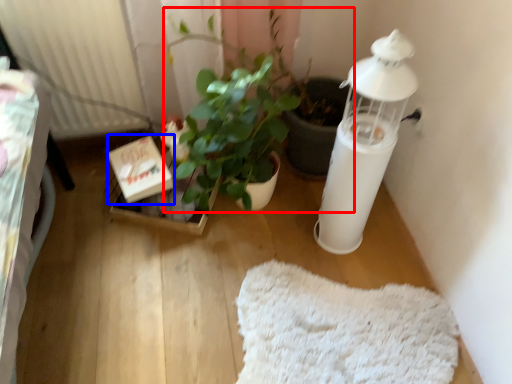
Question: Which object appears farthest to the camera in this image, houseplant (highlighted by a red box) or cardboard box (highlighted by a blue box)?

Choices:
 (A) houseplant
 (B) cardboard box

Answer: (B)